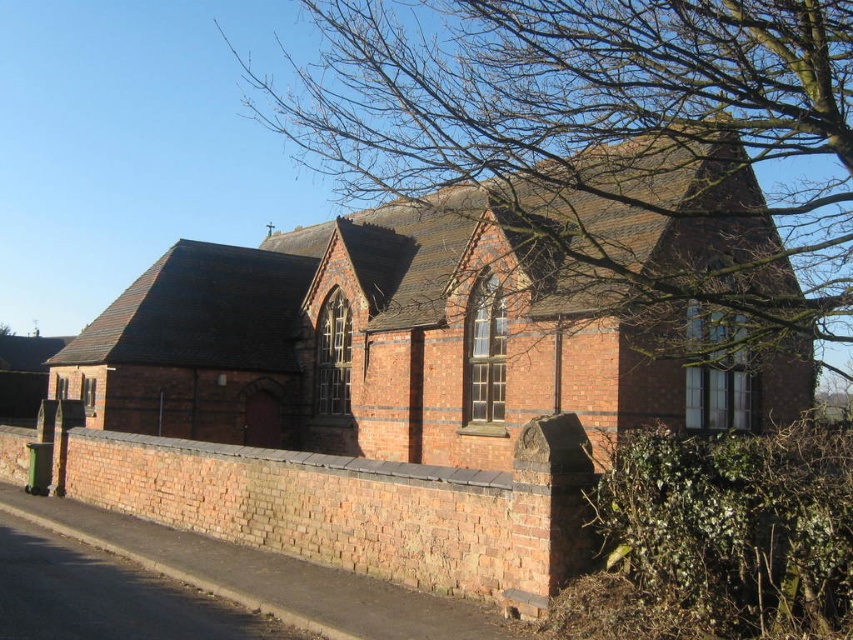
Is red brick church at center further to the viewer compared to bare branches at upper center?

No, it is not.

Who is lower down, red brick church at center or bare branches at upper center?

red brick church at center

Is point (670, 332) behind point (468, 26)?

No, it is in front of (468, 26).

Locate an element on the screen. The image size is (853, 640). red brick church at center is located at coordinates (453, 323).